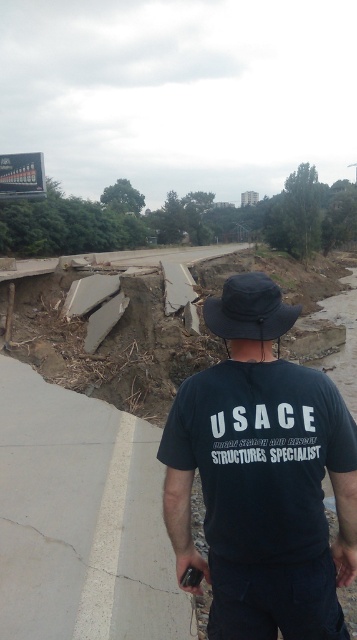
Can you confirm if dark blue cotton shirt at center is positioned to the right of black fabric baseball hat at center?

No, dark blue cotton shirt at center is not to the right of black fabric baseball hat at center.

How much distance is there between dark blue cotton shirt at center and black fabric baseball hat at center?

dark blue cotton shirt at center is 1.11 meters from black fabric baseball hat at center.

Who is more forward, (297, 408) or (290, 307)?

Positioned in front is point (297, 408).

Where is `dark blue cotton shirt at center`? The image size is (357, 640). dark blue cotton shirt at center is located at coordinates (262, 476).

Does gray concrete pavement at lower left have a greater width compared to black fabric baseball hat at center?

Correct, the width of gray concrete pavement at lower left exceeds that of black fabric baseball hat at center.

Who is positioned more to the right, gray concrete pavement at lower left or black fabric baseball hat at center?

black fabric baseball hat at center is more to the right.

You are a GUI agent. You are given a task and a screenshot of the screen. Output one action in this format:
    pyautogui.click(x=<x>, y=<y>)
    Task: Click on the gray concrete pavement at lower left
    This screenshot has width=357, height=640.
    Given the screenshot: What is the action you would take?
    pyautogui.click(x=82, y=518)

The height and width of the screenshot is (640, 357). In order to click on gray concrete pavement at lower left in this screenshot , I will do `click(82, 518)`.

Is dark blue cotton shirt at center wider than gray concrete pavement at lower left?

Incorrect, dark blue cotton shirt at center's width does not surpass gray concrete pavement at lower left's.

Does dark blue cotton shirt at center have a lesser height compared to gray concrete pavement at lower left?

Incorrect, dark blue cotton shirt at center's height does not fall short of gray concrete pavement at lower left's.

This screenshot has width=357, height=640. What are the coordinates of `dark blue cotton shirt at center` in the screenshot? It's located at (262, 476).

Locate an element on the screen. dark blue cotton shirt at center is located at coordinates (262, 476).